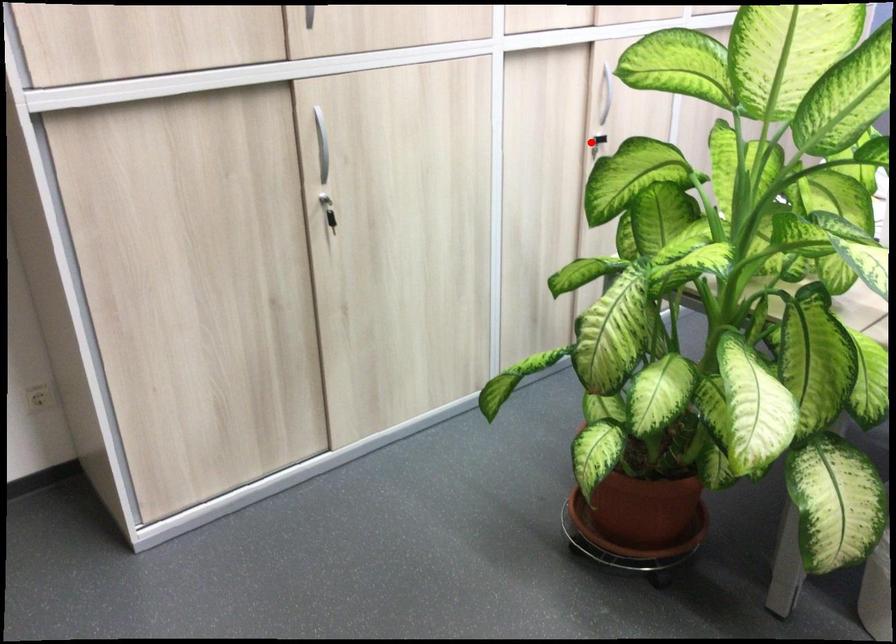
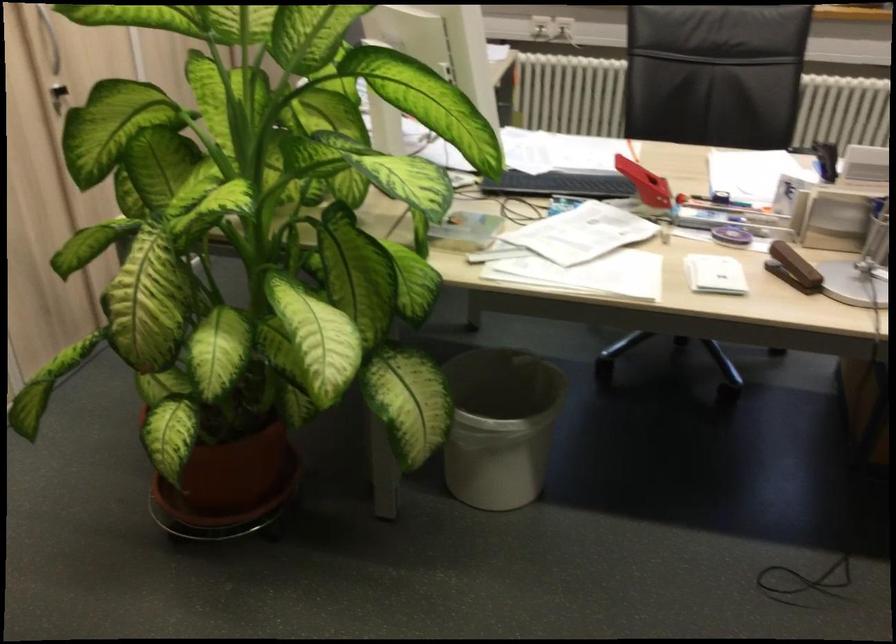
In the second image, find the point that corresponds to the highlighted location in the first image.

(57, 96)